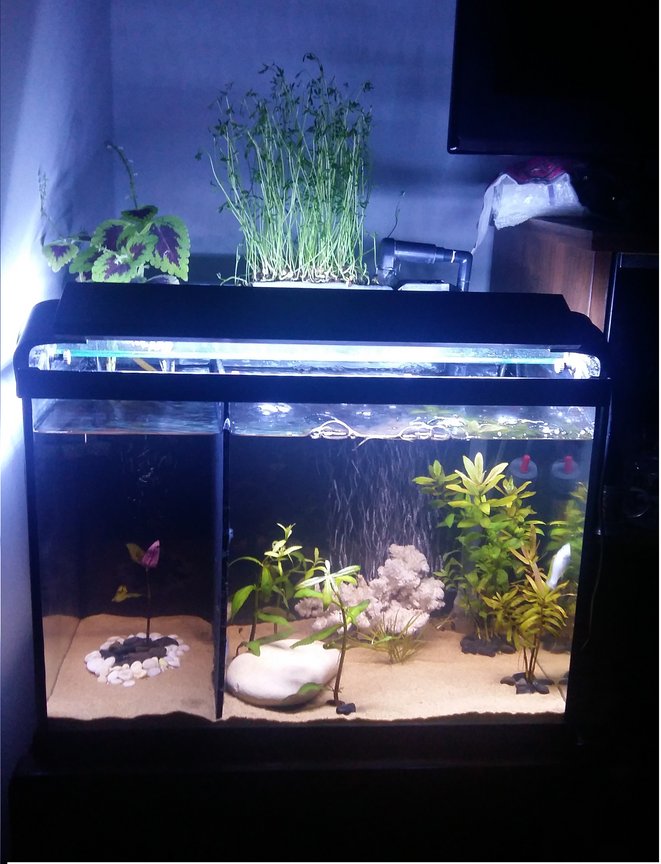
You are a GUI agent. You are given a task and a screenshot of the screen. Output one action in this format:
    pyautogui.click(x=<x>, y=<y>)
    Task: Click on the red knobs
    
    Given the screenshot: What is the action you would take?
    pos(524,465), pos(570,462)